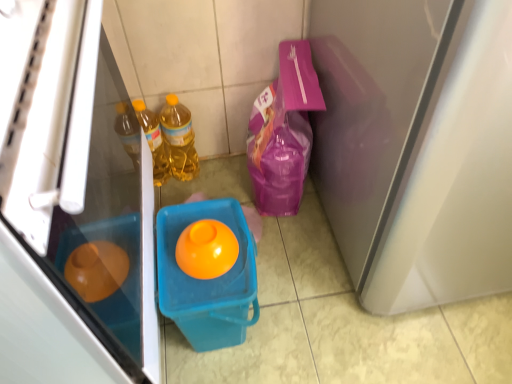
Locate an element on the screen. This screenshot has height=384, width=512. vacant space in front of translucent yellow bottle at center, acting as the first bottle starting from the right is located at coordinates (187, 192).